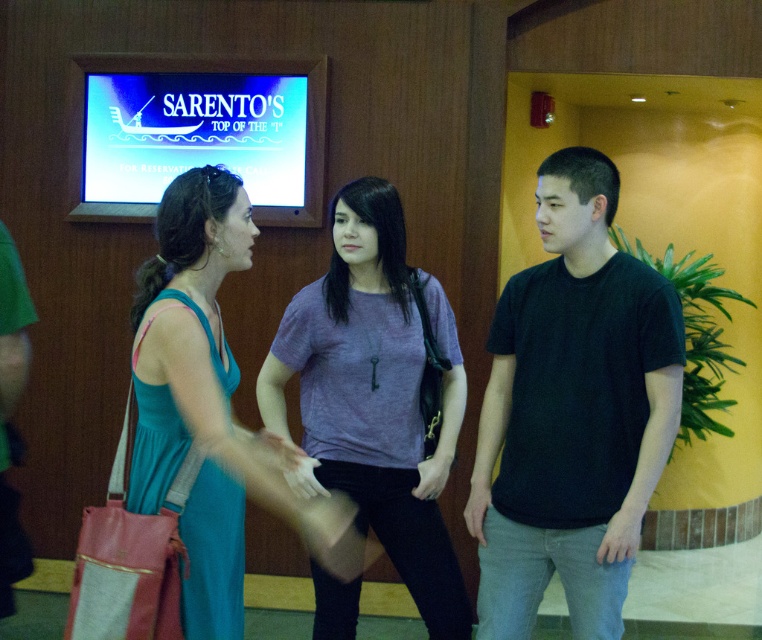
Question: Is black matte t-shirt at center further to the viewer compared to teal fabric dress at center?

Choices:
 (A) no
 (B) yes

Answer: (B)

Question: Which object is positioned closest to the teal fabric dress at center?

Choices:
 (A) purple fabric shirt at center
 (B) black matte t-shirt at center

Answer: (A)

Question: Which object appears closest to the camera in this image?

Choices:
 (A) teal fabric dress at center
 (B) purple fabric shirt at center

Answer: (A)

Question: Which object is positioned closest to the teal fabric dress at center?

Choices:
 (A) purple fabric shirt at center
 (B) black matte t-shirt at center

Answer: (A)

Question: Does purple fabric shirt at center have a larger size compared to teal fabric dress at center?

Choices:
 (A) yes
 (B) no

Answer: (B)

Question: Does black matte t-shirt at center appear on the right side of teal fabric dress at center?

Choices:
 (A) no
 (B) yes

Answer: (B)